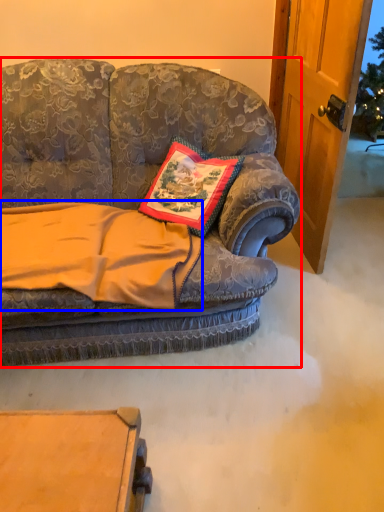
Question: Which of the following is the farthest to the observer, studio couch (highlighted by a red box) or blanket (highlighted by a blue box)?

Choices:
 (A) studio couch
 (B) blanket

Answer: (B)